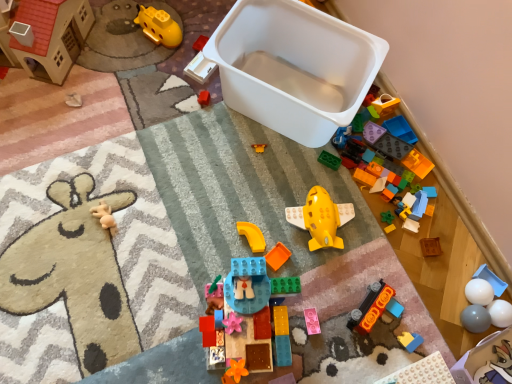
Where is `free spot in front of white plastic storage box at upper center, marked as the second storage box in a bottom-to-top arrangement`? This screenshot has height=384, width=512. free spot in front of white plastic storage box at upper center, marked as the second storage box in a bottom-to-top arrangement is located at coordinates (254, 192).